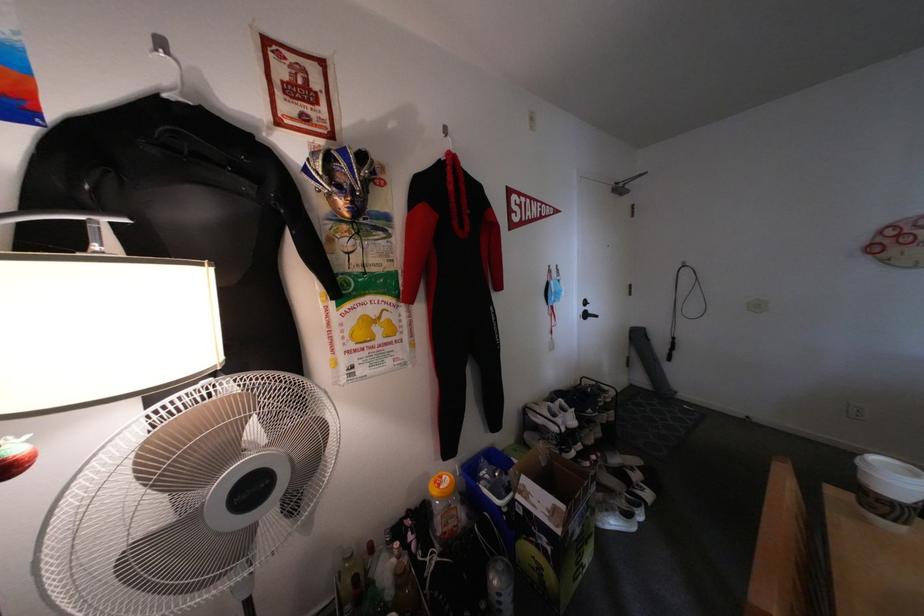
Find the location of a particular element. The height and width of the screenshot is (616, 924). white clothes hanger is located at coordinates (456, 288).